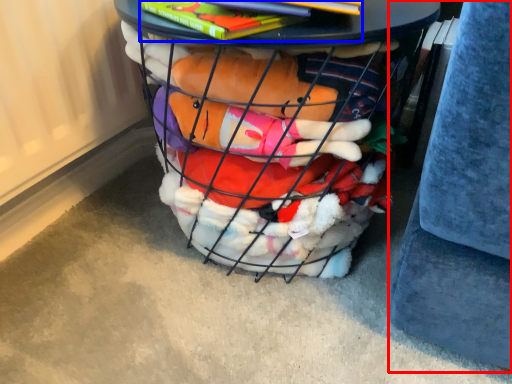
Question: Among these objects, which one is farthest to the camera, gray (highlighted by a red box) or book (highlighted by a blue box)?

Choices:
 (A) gray
 (B) book

Answer: (B)